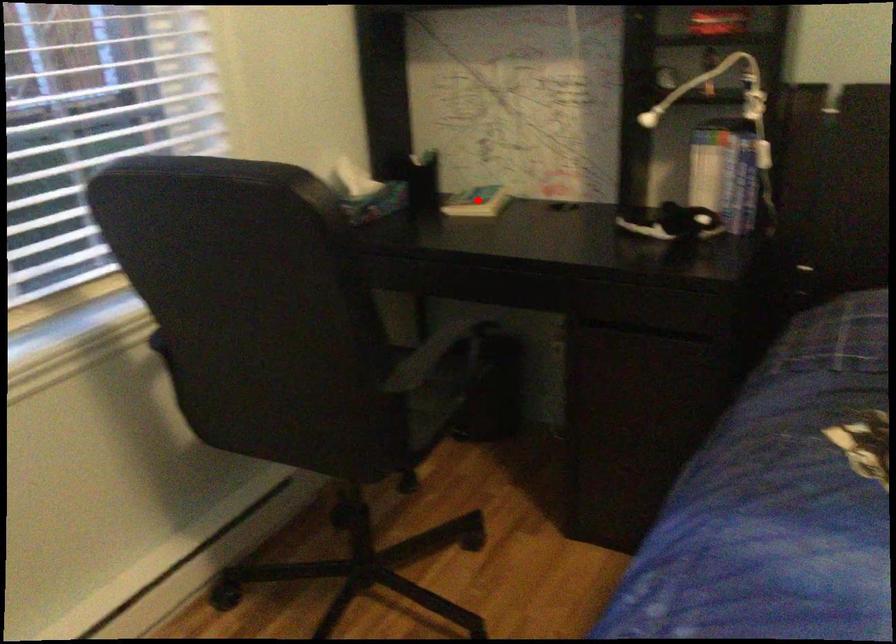
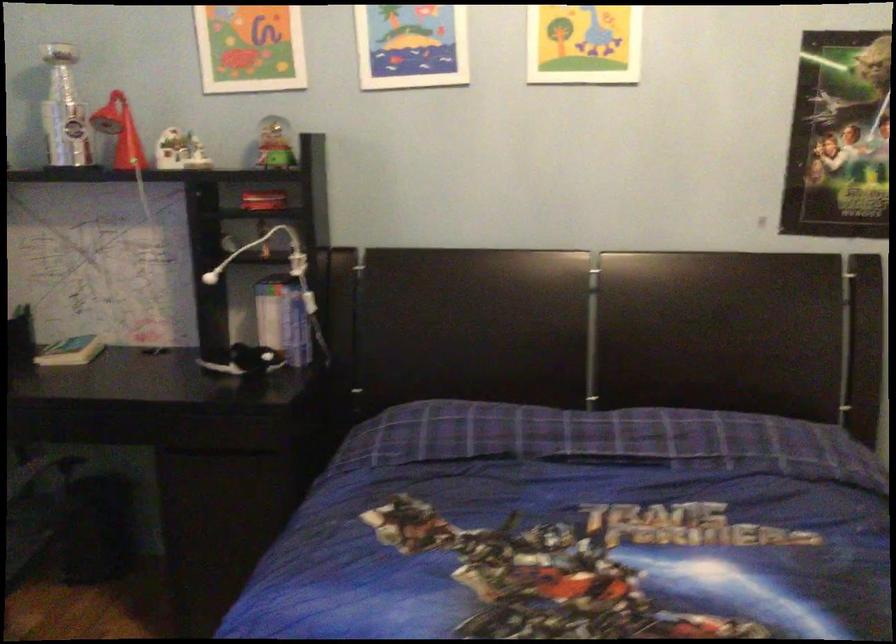
Find the pixel in the second image that matches the highlighted location in the first image.

(71, 351)